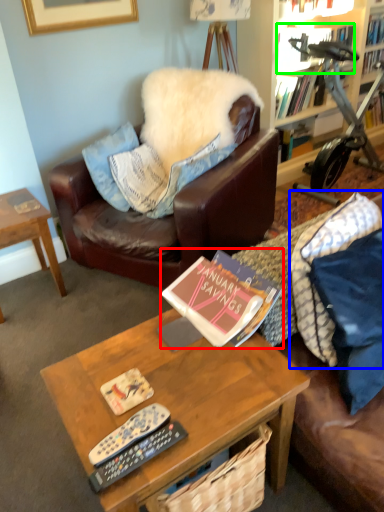
Question: Which object is the closest to the book (highlighted by a red box)? Choose among these: pillow (highlighted by a blue box) or book (highlighted by a green box).

Choices:
 (A) pillow
 (B) book

Answer: (A)